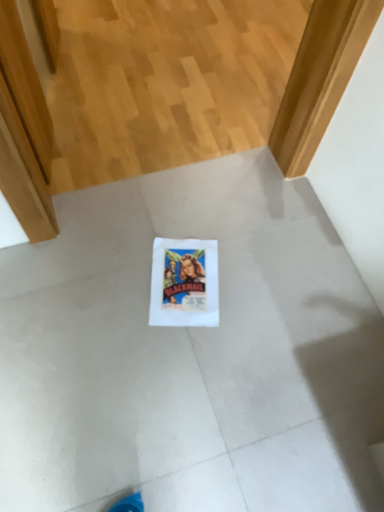
You are a GUI agent. You are given a task and a screenshot of the screen. Output one action in this format:
    pyautogui.click(x=<x>, y=<y>)
    Task: Click on the vacant space to the right of white paper flyer at center
    This screenshot has width=384, height=512.
    Given the screenshot: What is the action you would take?
    pyautogui.click(x=256, y=287)